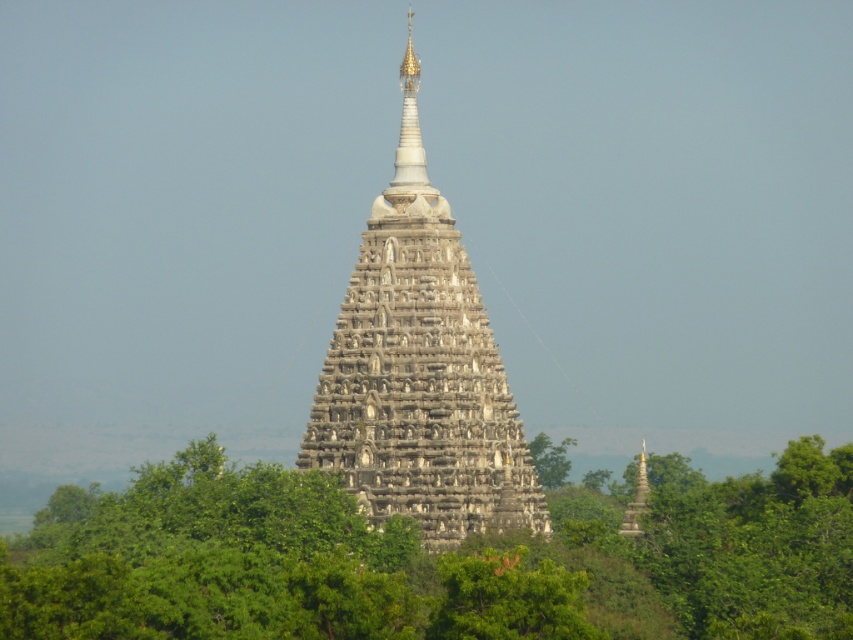
Between point (376, 508) and point (540, 474), which one is positioned in front?

Point (376, 508) is more forward.

Does gray stone pagoda at center have a greater width compared to green leafy tree at center?

Indeed, gray stone pagoda at center has a greater width compared to green leafy tree at center.

This screenshot has height=640, width=853. I want to click on gray stone pagoda at center, so click(x=421, y=371).

What are the coordinates of `gray stone pagoda at center` in the screenshot? It's located at (x=421, y=371).

The width and height of the screenshot is (853, 640). Describe the element at coordinates (434, 557) in the screenshot. I see `green leafy trees at center` at that location.

From the picture: Is green leafy trees at center positioned behind green leafy tree at center?

No, it is not.

What do you see at coordinates (434, 557) in the screenshot?
I see `green leafy trees at center` at bounding box center [434, 557].

Where is `green leafy trees at center`? The image size is (853, 640). green leafy trees at center is located at coordinates (434, 557).

Does green leafy trees at center come behind gray stone pagoda at center?

No, green leafy trees at center is in front of gray stone pagoda at center.

Who is positioned more to the right, green leafy trees at center or gray stone pagoda at center?

gray stone pagoda at center

Between point (96, 636) and point (341, 432), which one is positioned in front?

Point (96, 636)

Where is `green leafy trees at center`? This screenshot has height=640, width=853. green leafy trees at center is located at coordinates (434, 557).